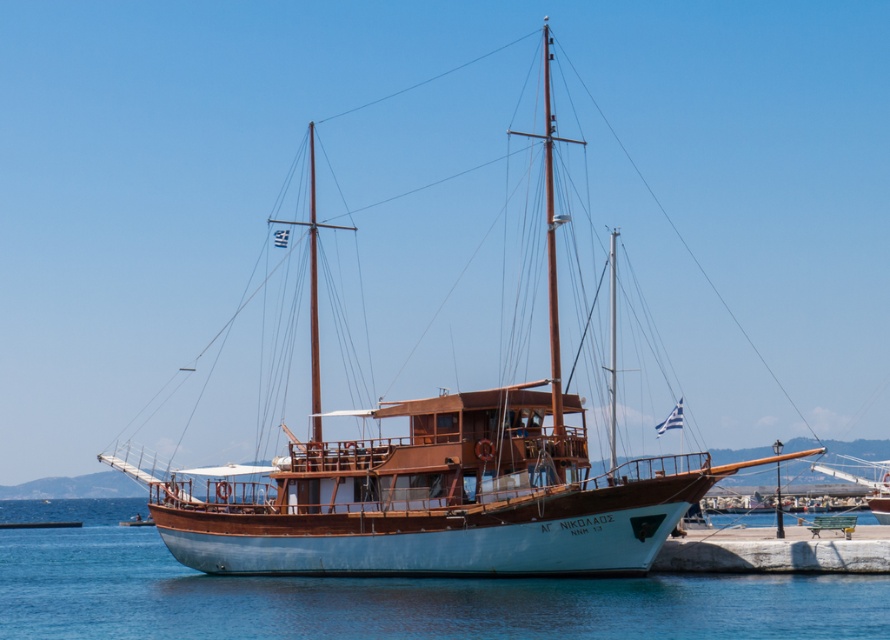
You are standing on the pier and want to board the white wooden sailboat at center. Based on its location coordinates, can you estimate where exactly on the pier you should walk to in order to reach the boat?

The white wooden sailboat at center is located at coordinates point (435, 477). To board it, you should walk to the central area of the pier closest to these coordinates.

You are standing on the pier looking at the boat. There are two points marked on the boat. Which point is closer to you, point (x=526, y=556) or point (x=243, y=582)?

Point (x=526, y=556) is closer to the viewer than point (x=243, y=582).